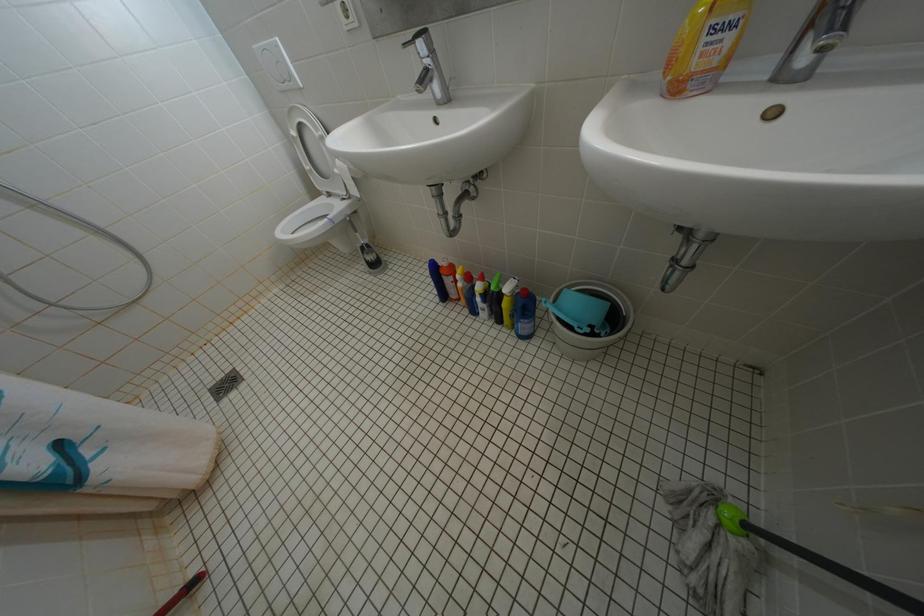
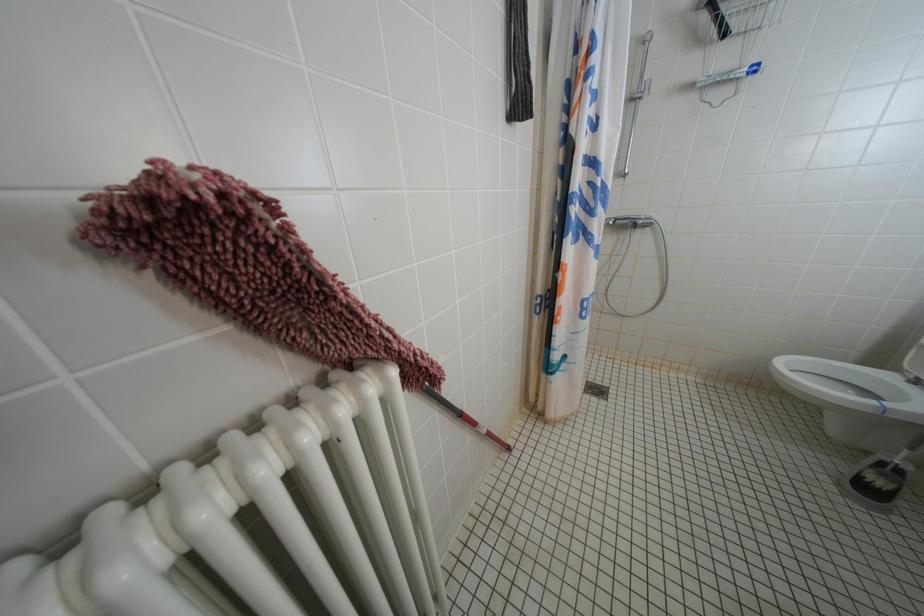
Consider the image. First-person continuous shooting, in which direction is the camera rotating?

The rotation direction of the camera is left-down.